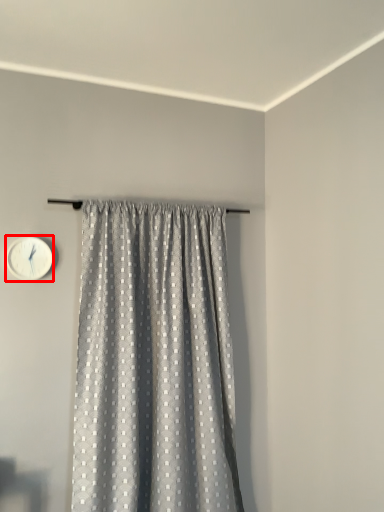
Question: Observing the image, what is the correct spatial positioning of wall clock (annotated by the red box) in reference to curtain?

Choices:
 (A) right
 (B) left

Answer: (B)